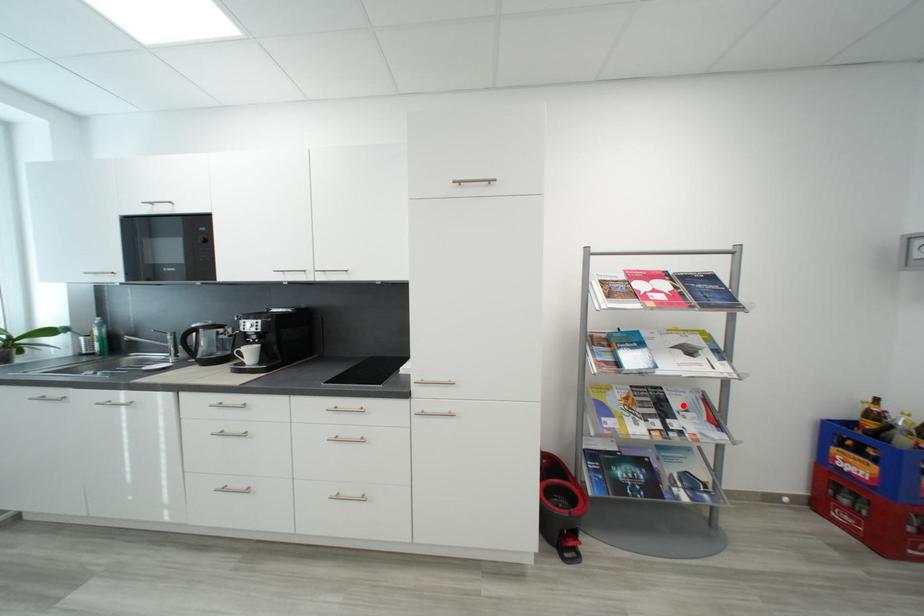
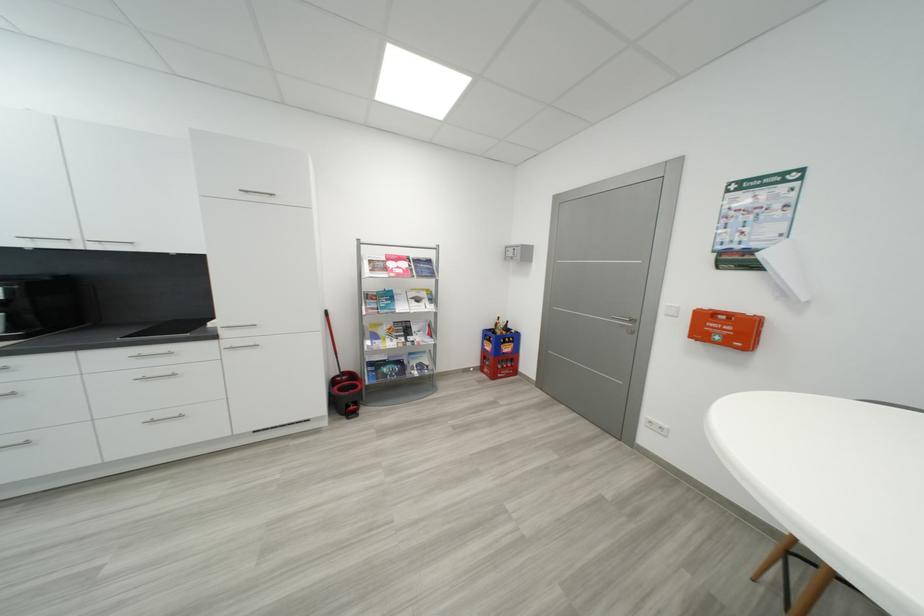
Find the pixel in the second image that matches the highlighted location in the first image.

(421, 330)